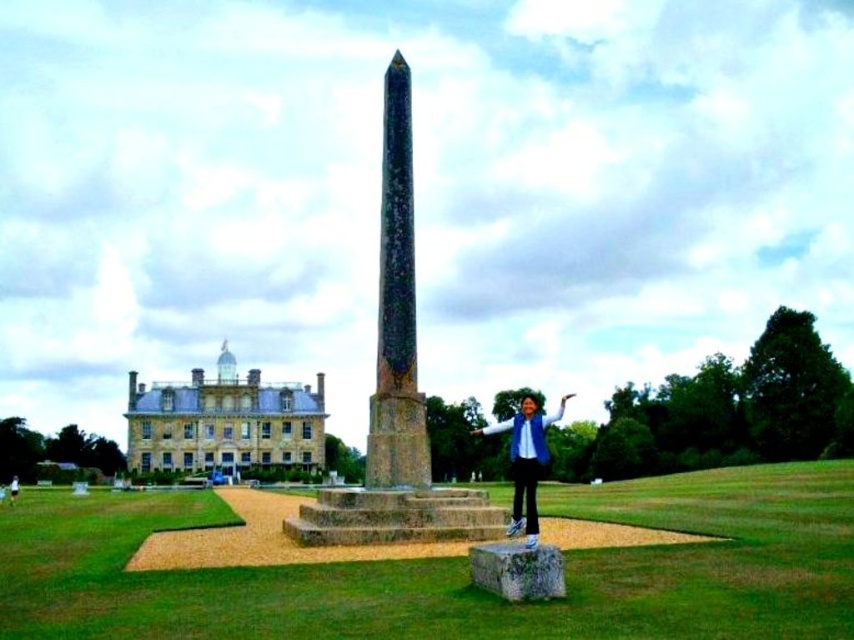
Which of these two, blue denim jacket at center or matte black jacket at center, stands shorter?

matte black jacket at center is shorter.

Can you confirm if blue denim jacket at center is taller than matte black jacket at center?

Indeed, blue denim jacket at center has a greater height compared to matte black jacket at center.

Does point (525, 397) come in front of point (10, 486)?

That is False.

At what (x,y) coordinates should I click in order to perform the action: click on blue denim jacket at center. Please return your answer as a coordinate pair (x, y). The width and height of the screenshot is (854, 640). Looking at the image, I should click on (525, 460).

Does point (379, 324) come in front of point (408, 100)?

Yes, it is.

Is point (410, 353) less distant than point (382, 452)?

That is False.

This screenshot has height=640, width=854. I want to click on green stone obelisk at center, so click(x=395, y=388).

Does black granite obelisk at center have a greater width compared to matte black jacket at center?

No, black granite obelisk at center is not wider than matte black jacket at center.

Is point (398, 179) positioned behind point (12, 497)?

That is False.

Identify the location of black granite obelisk at center. The height and width of the screenshot is (640, 854). (396, 308).